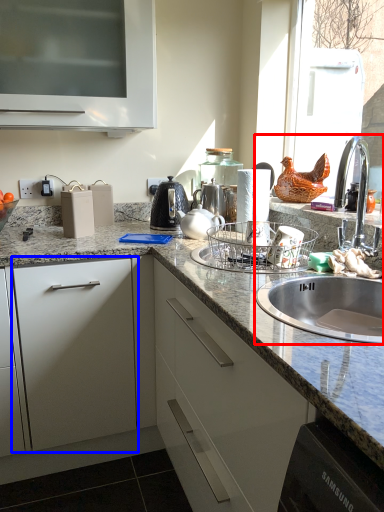
Question: Which point is closer to the camera, sink (highlighted by a red box) or drawer (highlighted by a blue box)?

Choices:
 (A) sink
 (B) drawer

Answer: (A)